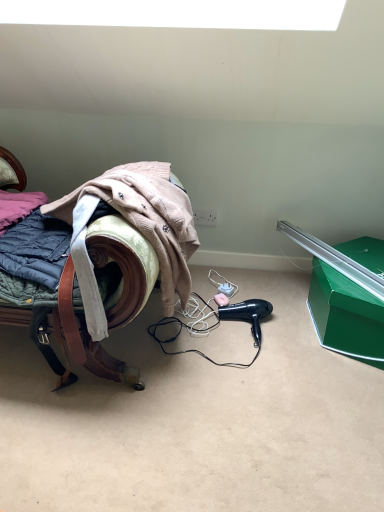
The height and width of the screenshot is (512, 384). In order to click on vacant area situated to the left side of black plastic hair dryer at lower center in this screenshot , I will do `click(206, 331)`.